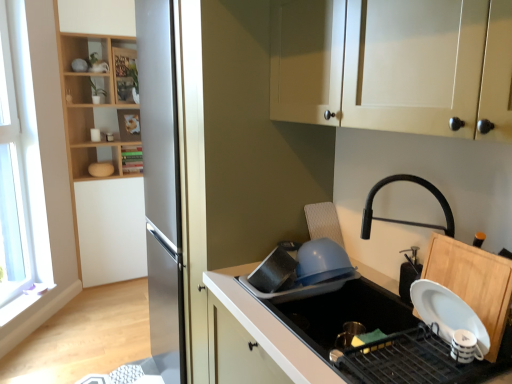
Question: Is white matte countertop at lower right outside of black matte soap dispenser at right, the 1th appliance positioned from the right?

Choices:
 (A) yes
 (B) no

Answer: (A)

Question: Can you confirm if white matte countertop at lower right is wider than black matte soap dispenser at right, placed as the 2th appliance when sorted from left to right?

Choices:
 (A) no
 (B) yes

Answer: (B)

Question: Considering the relative sizes of white matte countertop at lower right and black matte soap dispenser at right, the 1th appliance positioned from the right, in the image provided, is white matte countertop at lower right smaller than black matte soap dispenser at right, the 1th appliance positioned from the right,?

Choices:
 (A) no
 (B) yes

Answer: (A)

Question: Would you say white matte countertop at lower right is a long distance from black matte soap dispenser at right, placed as the 2th appliance when sorted from left to right?

Choices:
 (A) no
 (B) yes

Answer: (A)

Question: Can you confirm if white matte countertop at lower right is bigger than black matte soap dispenser at right, placed as the 2th appliance when sorted from left to right?

Choices:
 (A) yes
 (B) no

Answer: (A)

Question: Would you say white matte cabinet at upper center is to the left or to the right of white matte countertop at lower right in the picture?

Choices:
 (A) right
 (B) left

Answer: (A)

Question: In terms of height, does white matte cabinet at upper center look taller or shorter compared to white matte countertop at lower right?

Choices:
 (A) tall
 (B) short

Answer: (B)

Question: Considering the positions of point (346, 14) and point (282, 360), is point (346, 14) closer or farther from the camera than point (282, 360)?

Choices:
 (A) closer
 (B) farther

Answer: (B)

Question: Considering the positions of white matte cabinet at upper center and white matte countertop at lower right in the image, is white matte cabinet at upper center wider or thinner than white matte countertop at lower right?

Choices:
 (A) thin
 (B) wide

Answer: (A)

Question: In the image, is white matte countertop at lower right positioned in front of or behind white matte cabinet at upper center?

Choices:
 (A) front
 (B) behind

Answer: (B)

Question: In terms of width, does white matte countertop at lower right look wider or thinner when compared to white matte cabinet at upper center?

Choices:
 (A) wide
 (B) thin

Answer: (A)

Question: From the image's perspective, relative to white matte cabinet at upper center, is white matte countertop at lower right above or below?

Choices:
 (A) below
 (B) above

Answer: (A)

Question: Is white matte countertop at lower right taller or shorter than white matte cabinet at upper center?

Choices:
 (A) tall
 (B) short

Answer: (A)

Question: From the image's perspective, is transparent glass window at left positioned above or below green matte bookshelf at upper left, which appears as the third shelf when viewed from the top?

Choices:
 (A) above
 (B) below

Answer: (B)

Question: From their relative heights in the image, would you say transparent glass window at left is taller or shorter than green matte bookshelf at upper left, the 1th shelf ordered from the bottom?

Choices:
 (A) tall
 (B) short

Answer: (A)